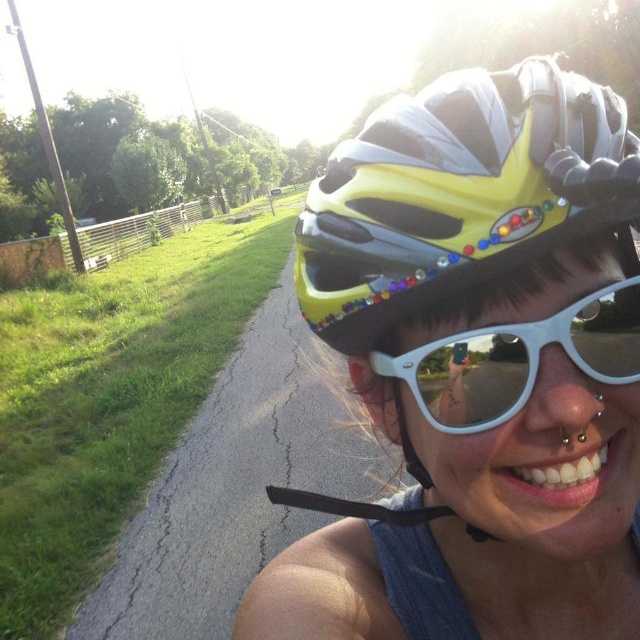
Is the position of yellow shiny helmet at center more distant than that of white reflective sunglasses at center?

No, it is not.

Does yellow shiny helmet at center appear under white reflective sunglasses at center?

No.

Identify the location of yellow shiny helmet at center. (458, 193).

Which of these two, yellow matte helmet at center or yellow shiny helmet at center, stands taller?

With more height is yellow matte helmet at center.

What do you see at coordinates (477, 368) in the screenshot?
I see `yellow matte helmet at center` at bounding box center [477, 368].

The image size is (640, 640). I want to click on yellow matte helmet at center, so click(477, 368).

Can you confirm if yellow matte helmet at center is positioned above white reflective sunglasses at center?

No.

What are the coordinates of `yellow matte helmet at center` in the screenshot? It's located at (477, 368).

Find the location of a particular element. This screenshot has height=640, width=640. yellow matte helmet at center is located at coordinates (477, 368).